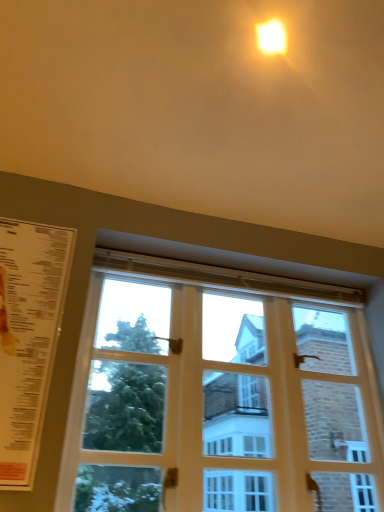
Question: Is white wooden window at center a part of matte yellow light at upper center?

Choices:
 (A) no
 (B) yes

Answer: (A)

Question: Does matte yellow light at upper center lie behind white wooden window at center?

Choices:
 (A) no
 (B) yes

Answer: (B)

Question: Is matte yellow light at upper center placed right next to white wooden window at center?

Choices:
 (A) yes
 (B) no

Answer: (B)

Question: Is matte yellow light at upper center far away from white wooden window at center?

Choices:
 (A) no
 (B) yes

Answer: (B)

Question: Is matte yellow light at upper center to the right of white wooden window at center from the viewer's perspective?

Choices:
 (A) yes
 (B) no

Answer: (A)

Question: Is matte yellow light at upper center in front of or behind white wooden window at center in the image?

Choices:
 (A) behind
 (B) front

Answer: (A)

Question: From their relative heights in the image, would you say matte yellow light at upper center is taller or shorter than white wooden window at center?

Choices:
 (A) tall
 (B) short

Answer: (B)

Question: Considering the relative positions of matte yellow light at upper center and white wooden window at center in the image provided, is matte yellow light at upper center to the left or to the right of white wooden window at center?

Choices:
 (A) left
 (B) right

Answer: (B)

Question: From a real-world perspective, is matte yellow light at upper center positioned above or below white wooden window at center?

Choices:
 (A) above
 (B) below

Answer: (A)

Question: Is white wooden window at center in front of or behind matte yellow light at upper center in the image?

Choices:
 (A) behind
 (B) front

Answer: (B)

Question: Is white wooden window at center bigger or smaller than matte yellow light at upper center?

Choices:
 (A) big
 (B) small

Answer: (A)

Question: Do you think white wooden window at center is within matte yellow light at upper center, or outside of it?

Choices:
 (A) outside
 (B) inside

Answer: (A)

Question: Considering the positions of white wooden window at center and matte yellow light at upper center in the image, is white wooden window at center wider or thinner than matte yellow light at upper center?

Choices:
 (A) wide
 (B) thin

Answer: (B)

Question: Considering the positions of white paper menu at left and matte yellow light at upper center in the image, is white paper menu at left bigger or smaller than matte yellow light at upper center?

Choices:
 (A) big
 (B) small

Answer: (A)

Question: Is white paper menu at left taller or shorter than matte yellow light at upper center?

Choices:
 (A) tall
 (B) short

Answer: (A)